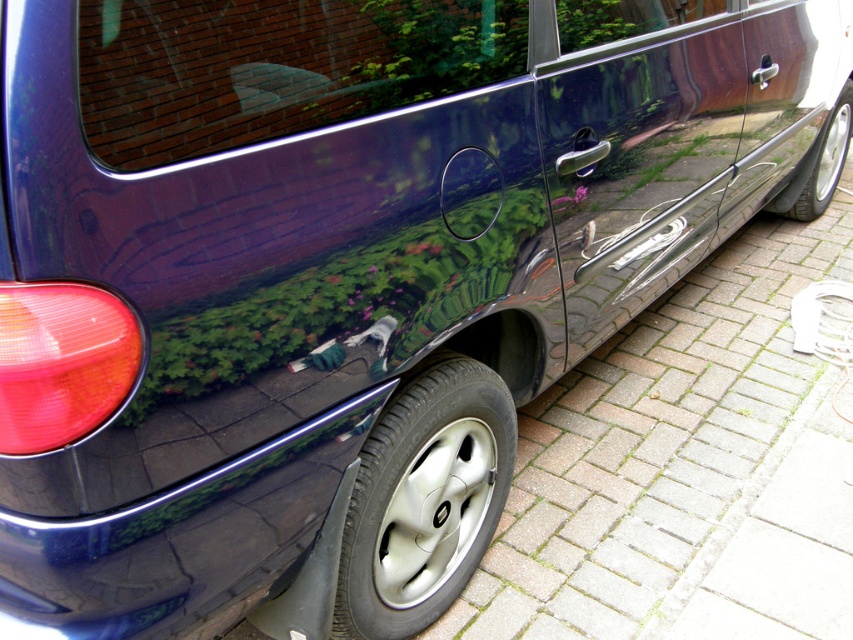
Which is more to the right, silver metallic tire at lower right or shiny metallic tire at right?

Positioned to the right is shiny metallic tire at right.

Is silver metallic tire at lower right wider than shiny metallic tire at right?

Incorrect, silver metallic tire at lower right's width does not surpass shiny metallic tire at right's.

Which is behind, point (433, 371) or point (822, 166)?

The point (822, 166) is behind.

Identify the location of silver metallic tire at lower right. This screenshot has height=640, width=853. (424, 500).